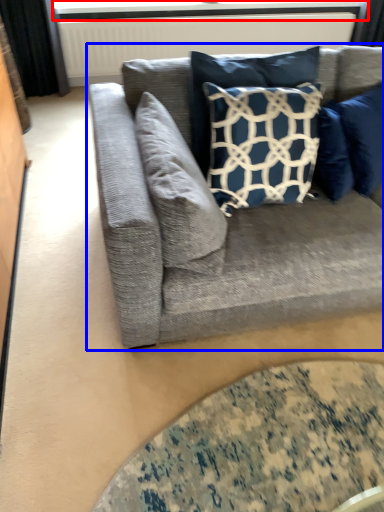
Question: Which object is further to the camera taking this photo, window screen (highlighted by a red box) or studio couch (highlighted by a blue box)?

Choices:
 (A) window screen
 (B) studio couch

Answer: (A)